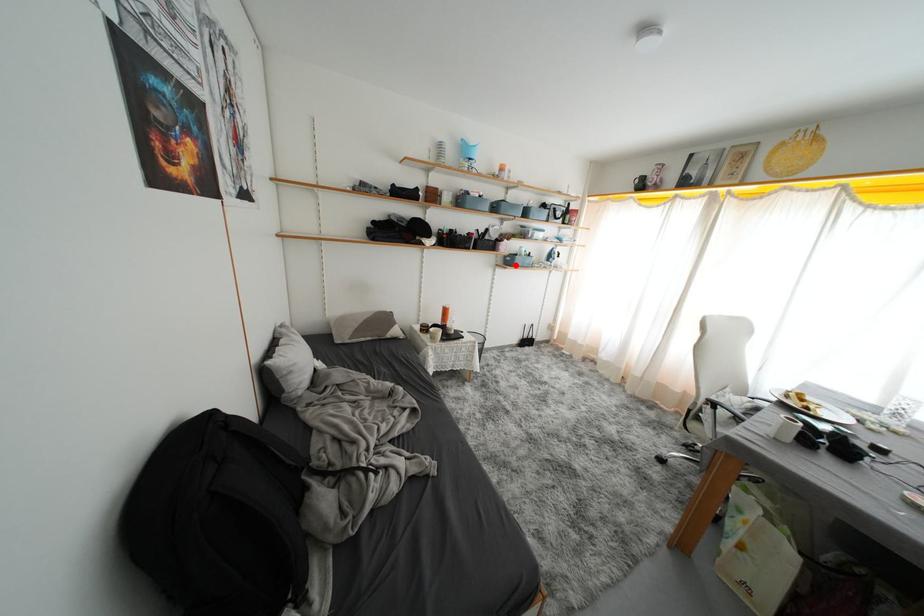
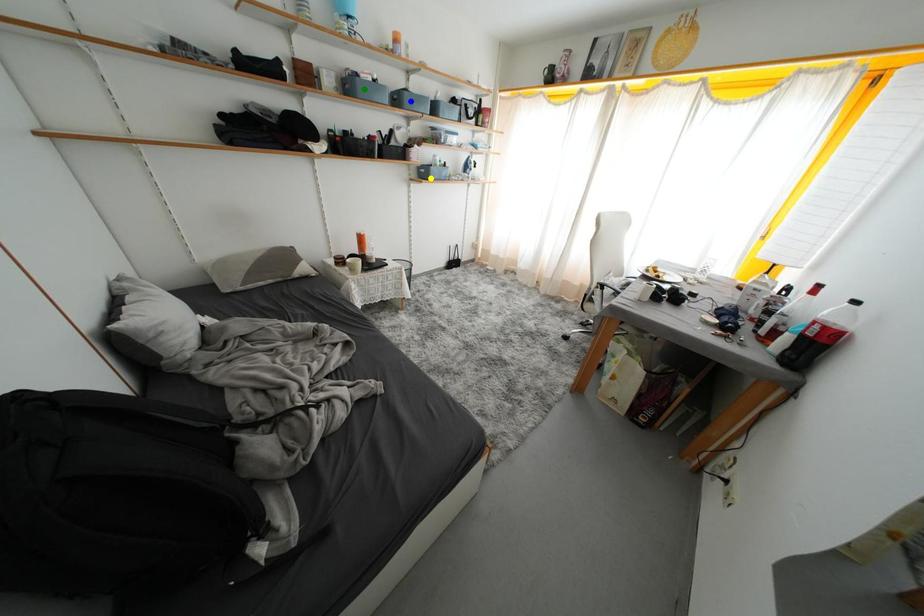
Question: I am providing you with two images of the same scene from different viewpoints. A red point is marked on the first image. You are given multiple points on the second image. In image 2, which mark is for the same physical point as the one in image 1?

Choices:
 (A) blue point
 (B) green point
 (C) yellow point

Answer: (C)